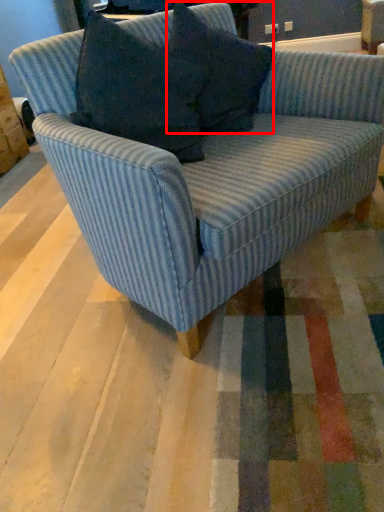
Question: From the image's perspective, what is the correct spatial relationship of pillow (annotated by the red box) in relation to studio couch?

Choices:
 (A) above
 (B) below

Answer: (A)